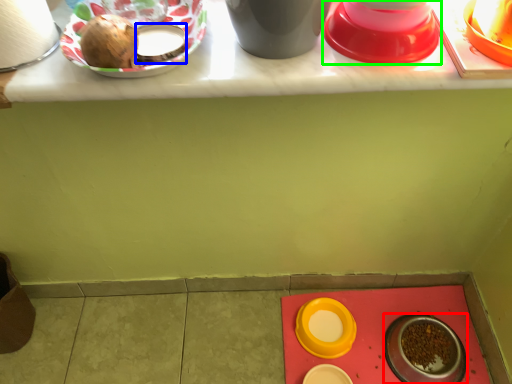
Question: Which is farther away from tableware (highlighted by a red box)? tableware (highlighted by a blue box) or tableware (highlighted by a green box)?

Choices:
 (A) tableware
 (B) tableware

Answer: (A)